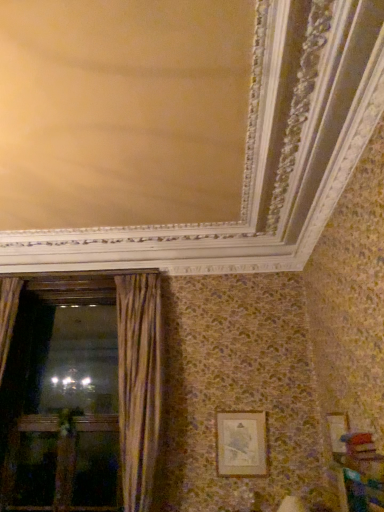
Question: Is wooden cabinet at lower right bigger or smaller than gold textured frame at lower right?

Choices:
 (A) big
 (B) small

Answer: (A)

Question: Choose the correct answer: Is wooden cabinet at lower right inside gold textured frame at lower right or outside it?

Choices:
 (A) inside
 (B) outside

Answer: (B)

Question: Estimate the real-world distances between objects in this image. Which object is closer to the wooden cabinet at lower right?

Choices:
 (A) gold textured curtain at left
 (B) gold textured frame at lower right
 (C) wooden screen door at left

Answer: (B)

Question: Which object is the closest to the wooden screen door at left?

Choices:
 (A) wooden cabinet at lower right
 (B) gold textured curtain at left
 (C) gold textured frame at lower right

Answer: (B)